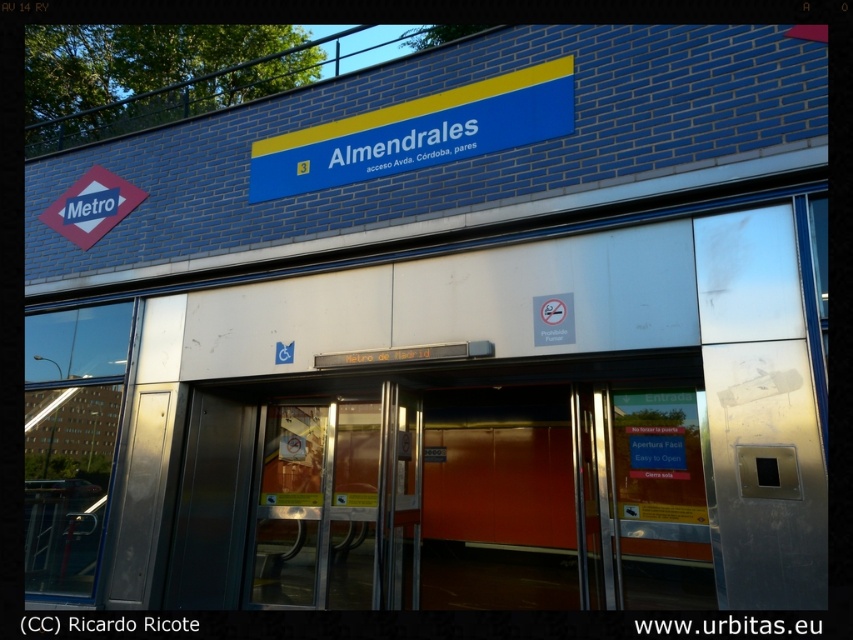
You are a delivery person with a cart that is 2 meters wide. You need to enter the metro station through the transparent glass door at center. There is a matte red diamond at upper left nearby. Can your cart fit through the space between them?

The transparent glass door at center and matte red diamond at upper left are 2.35 meters apart, so the cart that is 2 meters wide can fit through the space between them since the distance is greater than the cart width.